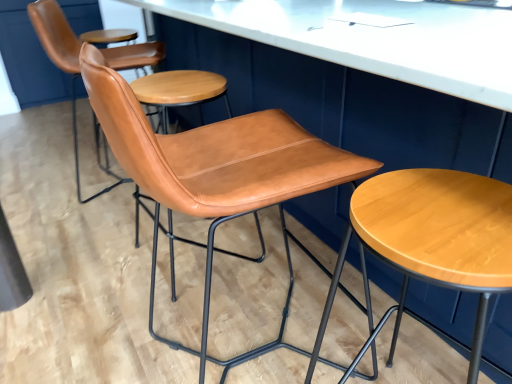
I want to click on free point below cognac leather chair at center, the second chair viewed from the front (from a real-world perspective), so click(177, 253).